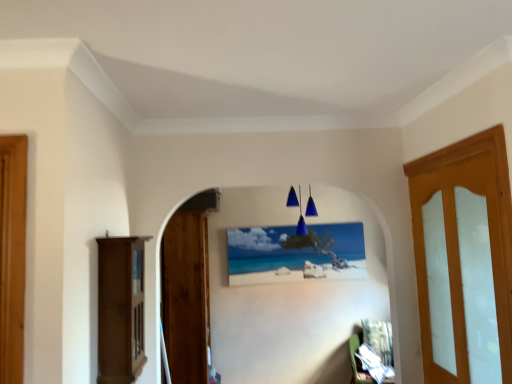
Describe the element at coordinates (295, 253) in the screenshot. I see `matte canvas painting at center` at that location.

Where is `light brown wooden door at right, which appears as the 1th door when viewed from the right`? This screenshot has width=512, height=384. light brown wooden door at right, which appears as the 1th door when viewed from the right is located at coordinates (460, 273).

Between denim fabric chair at lower right, the 2th furniture when ordered from top to bottom, and light brown wooden door at right, the 1th door in the front-to-back sequence, which one has smaller width?

light brown wooden door at right, the 1th door in the front-to-back sequence, is thinner.

How many degrees apart are the facing directions of denim fabric chair at lower right, which ranks as the 1th furniture in right-to-left order, and light brown wooden door at right, arranged as the 2th door when viewed from the left?

They differ by 68.2 degrees in their facing directions.

Can we say denim fabric chair at lower right, the 2th furniture when ordered from top to bottom, lies outside light brown wooden door at right, arranged as the 2th door when viewed from the left?

That's correct, denim fabric chair at lower right, the 2th furniture when ordered from top to bottom, is outside of light brown wooden door at right, arranged as the 2th door when viewed from the left.

Does point (361, 340) come closer to viewer compared to point (474, 359)?

No, (361, 340) is further to viewer.

Is denim fabric chair at lower right, the second furniture when ordered from left to right, turned away from matte wood cabinet at left, positioned as the first furniture in top-to-bottom order?

No, denim fabric chair at lower right, the second furniture when ordered from left to right, is not facing the opposite direction of matte wood cabinet at left, positioned as the first furniture in top-to-bottom order.

How different are the orientations of denim fabric chair at lower right, the 1th furniture viewed from the back, and matte wood cabinet at left, positioned as the first furniture in top-to-bottom order, in degrees?

They differ by 113 degrees in their facing directions.

Considering the positions of objects denim fabric chair at lower right, the 1th furniture viewed from the back, and matte wood cabinet at left, positioned as the 2th furniture in right-to-left order, in the image provided, who is more to the right, denim fabric chair at lower right, the 1th furniture viewed from the back, or matte wood cabinet at left, positioned as the 2th furniture in right-to-left order,?

Answer: From the viewer's perspective, denim fabric chair at lower right, the 1th furniture viewed from the back, appears more on the right side.

Who is taller, denim fabric chair at lower right, the 1th furniture viewed from the back, or matte wood cabinet at left, positioned as the 2th furniture in right-to-left order?

With more height is matte wood cabinet at left, positioned as the 2th furniture in right-to-left order.

From the image's perspective, which one is positioned lower, light brown wooden door at right, arranged as the second door when viewed from the back, or matte canvas painting at center?

From the image's view, matte canvas painting at center is below.

Can you see light brown wooden door at right, arranged as the 2th door when viewed from the left, touching matte canvas painting at center?

They are not placed beside each other.

From a real-world perspective, who is located lower, light brown wooden door at right, which appears as the 1th door when viewed from the right, or matte canvas painting at center?

From a 3D spatial view, light brown wooden door at right, which appears as the 1th door when viewed from the right, is below.

Looking at this image, do you think light brown wooden door at right, arranged as the second door when viewed from the back, is within matte canvas painting at center, or outside of it?

light brown wooden door at right, arranged as the second door when viewed from the back, is outside matte canvas painting at center.

Looking at this image, is light brown wooden door at right, the 1th door in the front-to-back sequence, with matte wood cabinet at left, marked as the 1th furniture in a left-to-right arrangement?

No, light brown wooden door at right, the 1th door in the front-to-back sequence, is not with matte wood cabinet at left, marked as the 1th furniture in a left-to-right arrangement.

Between light brown wooden door at right, arranged as the second door when viewed from the back, and matte wood cabinet at left, arranged as the first furniture when viewed from the front, which one is positioned in front?

light brown wooden door at right, arranged as the second door when viewed from the back, is more forward.

Is light brown wooden door at right, arranged as the second door when viewed from the back, not within matte wood cabinet at left, which is counted as the second furniture, starting from the back?

That's correct, light brown wooden door at right, arranged as the second door when viewed from the back, is outside of matte wood cabinet at left, which is counted as the second furniture, starting from the back.

How different are the orientations of blue glass pendant lights at center and matte canvas painting at center in degrees?

They differ by 2.82 degrees in their facing directions.

From a real-world perspective, does blue glass pendant lights at center sit lower than matte canvas painting at center?

No.

From the image's perspective, which is below, blue glass pendant lights at center or matte canvas painting at center?

matte canvas painting at center.

Is blue glass pendant lights at center in contact with matte canvas painting at center?

Result: blue glass pendant lights at center and matte canvas painting at center are not in contact.

From a real-world perspective, is blue glass pendant lights at center physically above matte wood cabinet at left, positioned as the 2th furniture in right-to-left order?

Correct, in the physical world, blue glass pendant lights at center is higher than matte wood cabinet at left, positioned as the 2th furniture in right-to-left order.

Is blue glass pendant lights at center in front of or behind matte wood cabinet at left, which is counted as the second furniture, starting from the back, in the image?

Visually, blue glass pendant lights at center is located behind matte wood cabinet at left, which is counted as the second furniture, starting from the back.

Does blue glass pendant lights at center turn towards matte wood cabinet at left, positioned as the first furniture in top-to-bottom order?

No, blue glass pendant lights at center is not turned towards matte wood cabinet at left, positioned as the first furniture in top-to-bottom order.

How many degrees apart are the facing directions of blue glass pendant lights at center and matte wood cabinet at left, marked as the 1th furniture in a left-to-right arrangement?

The facing directions of blue glass pendant lights at center and matte wood cabinet at left, marked as the 1th furniture in a left-to-right arrangement, are 87.6 degrees apart.

Does matte wood cabinet at left, marked as the 1th furniture in a left-to-right arrangement, have a smaller size compared to wooden door at left, the second door viewed from the front?

Yes, matte wood cabinet at left, marked as the 1th furniture in a left-to-right arrangement, is smaller than wooden door at left, the second door viewed from the front.

Which of these two, matte wood cabinet at left, positioned as the 2th furniture in right-to-left order, or wooden door at left, the second door viewed from the front, is wider?

wooden door at left, the second door viewed from the front, is wider.

Is matte wood cabinet at left, which is counted as the second furniture, starting from the back, taller or shorter than wooden door at left, the second door viewed from the front?

Considering their sizes, matte wood cabinet at left, which is counted as the second furniture, starting from the back, has less height than wooden door at left, the second door viewed from the front.

At what (x,y) coordinates should I click in order to perform the action: click on door that is the 1st object to the left of the denim fabric chair at lower right, the first furniture from the bottom, starting at the anchor. Please return your answer as a coordinate pair (x, y). The image size is (512, 384). Looking at the image, I should click on (460, 273).

Locate an element on the screen. The width and height of the screenshot is (512, 384). furniture that is below the matte wood cabinet at left, arranged as the first furniture when viewed from the front (from the image's perspective) is located at coordinates (358, 362).

Looking at the image, which one is located closer to blue glass pendant lights at center, matte canvas painting at center or light brown wooden door at right, which appears as the 1th door when viewed from the right?

matte canvas painting at center.

Which object lies further to the anchor point matte canvas painting at center, matte wood cabinet at left, which appears as the 2th furniture when ordered from the bottom, or blue glass pendant lights at center?

matte wood cabinet at left, which appears as the 2th furniture when ordered from the bottom.

Which object lies nearer to the anchor point matte canvas painting at center, matte wood cabinet at left, which appears as the 2th furniture when ordered from the bottom, or wooden door at left, which is the 1th door in back-to-front order?

wooden door at left, which is the 1th door in back-to-front order.

From the image, which object appears to be farther from blue glass pendant lights at center, light brown wooden door at right, arranged as the 2th door when viewed from the left, or wooden door at left, the second door positioned from the right?

light brown wooden door at right, arranged as the 2th door when viewed from the left, lies further to blue glass pendant lights at center than the other object.

Which object lies further to the anchor point denim fabric chair at lower right, the 2th furniture when ordered from top to bottom, blue glass pendant lights at center or wooden door at left, the second door viewed from the front?

wooden door at left, the second door viewed from the front, is positioned further to the anchor denim fabric chair at lower right, the 2th furniture when ordered from top to bottom.

From the image, which object appears to be farther from wooden door at left, which is the 1th door in back-to-front order, light brown wooden door at right, which appears as the 1th door when viewed from the right, or matte canvas painting at center?

light brown wooden door at right, which appears as the 1th door when viewed from the right, is further to wooden door at left, which is the 1th door in back-to-front order.

From the picture: Which object lies further to the anchor point matte canvas painting at center, blue glass pendant lights at center or denim fabric chair at lower right, which ranks as the 1th furniture in right-to-left order?

denim fabric chair at lower right, which ranks as the 1th furniture in right-to-left order, is positioned further to the anchor matte canvas painting at center.

Estimate the real-world distances between objects in this image. Which object is closer to wooden door at left, the second door viewed from the front, matte wood cabinet at left, arranged as the first furniture when viewed from the front, or light brown wooden door at right, which appears as the 1th door when viewed from the right?

matte wood cabinet at left, arranged as the first furniture when viewed from the front.

Where is `lamp between wooden door at left, the second door positioned from the right, and matte canvas painting at center`? This screenshot has width=512, height=384. lamp between wooden door at left, the second door positioned from the right, and matte canvas painting at center is located at coordinates (300, 211).

Find the location of `furniture between light brown wooden door at right, arranged as the 2th door when viewed from the left, and denim fabric chair at lower right, the second furniture when ordered from left to right, from front to back`. furniture between light brown wooden door at right, arranged as the 2th door when viewed from the left, and denim fabric chair at lower right, the second furniture when ordered from left to right, from front to back is located at coordinates (120, 309).

Image resolution: width=512 pixels, height=384 pixels. In order to click on door located between matte wood cabinet at left, positioned as the 2th furniture in right-to-left order, and blue glass pendant lights at center in the depth direction in this screenshot , I will do `click(186, 296)`.

The image size is (512, 384). Find the location of `furniture positioned between light brown wooden door at right, arranged as the second door when viewed from the back, and blue glass pendant lights at center from near to far`. furniture positioned between light brown wooden door at right, arranged as the second door when viewed from the back, and blue glass pendant lights at center from near to far is located at coordinates (120, 309).